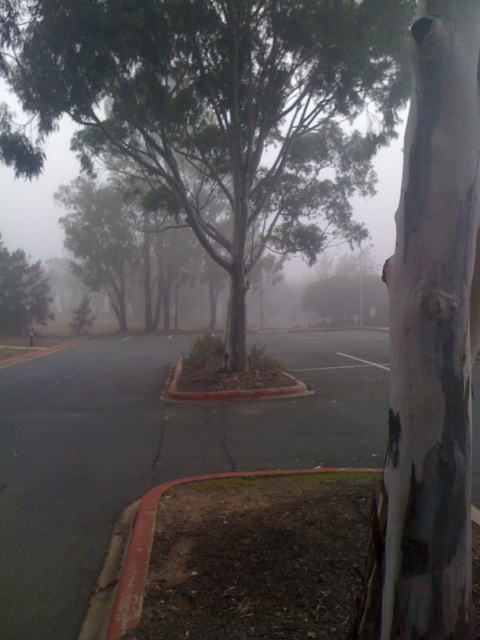
The height and width of the screenshot is (640, 480). Identify the location of white/scaly tree trunk at center-right. (433, 336).

Does white/scaly tree trunk at center-right have a larger size compared to green matte tree at center?

No, white/scaly tree trunk at center-right is not bigger than green matte tree at center.

Is point (392, 472) less distant than point (17, 314)?

Yes, point (392, 472) is in front of point (17, 314).

Where is `white/scaly tree trunk at center-right`? white/scaly tree trunk at center-right is located at coordinates (433, 336).

Which is behind, point (144, 88) or point (3, 307)?

Positioned behind is point (3, 307).

Who is positioned more to the right, green rough bark tree at center or green matte tree at center?

Positioned to the right is green rough bark tree at center.

Between point (304, 108) and point (36, 304), which one is positioned behind?

The point (36, 304) is more distant.

Identify the location of green rough bark tree at center. (216, 109).

Is point (321, 141) positioned in front of point (398, 308)?

No, (321, 141) is further to viewer.

This screenshot has width=480, height=640. Describe the element at coordinates (216, 109) in the screenshot. I see `green rough bark tree at center` at that location.

Find the location of a particular element. green rough bark tree at center is located at coordinates (216, 109).